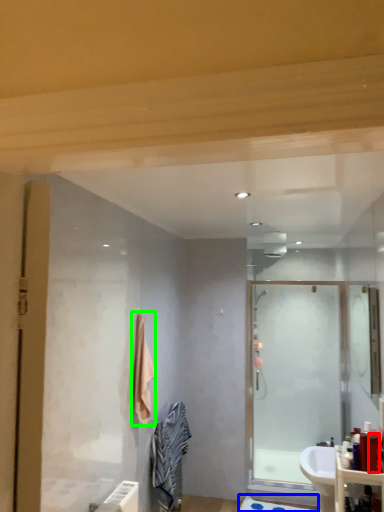
Question: Estimate the real-world distances between objects in this image. Which object is farther from toiletry (highlighted by a red box), bath mat (highlighted by a blue box) or bath towel (highlighted by a green box)?

Choices:
 (A) bath mat
 (B) bath towel

Answer: (A)